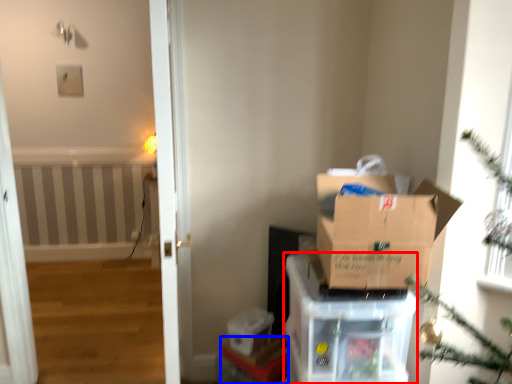
Question: Which of the following is the closest to the observer, cardboard box (highlighted by a red box) or furniture (highlighted by a blue box)?

Choices:
 (A) cardboard box
 (B) furniture

Answer: (A)